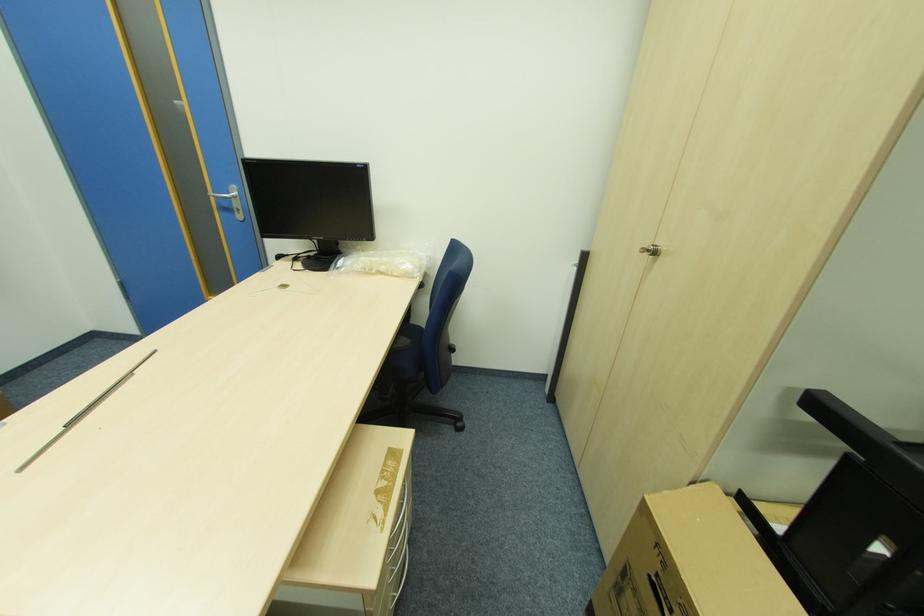
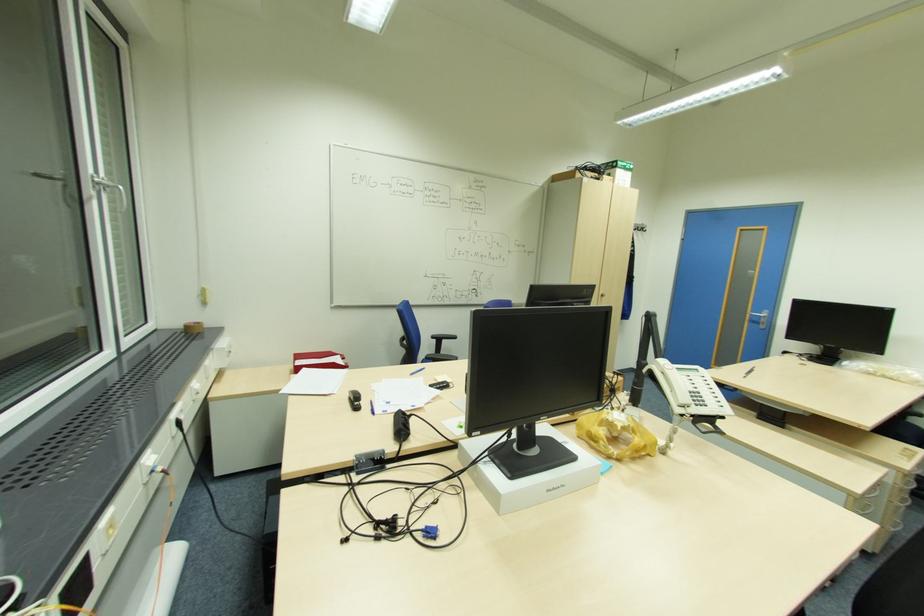
Locate, in the second image, the point that corresponds to (241,209) in the first image.

(766, 323)